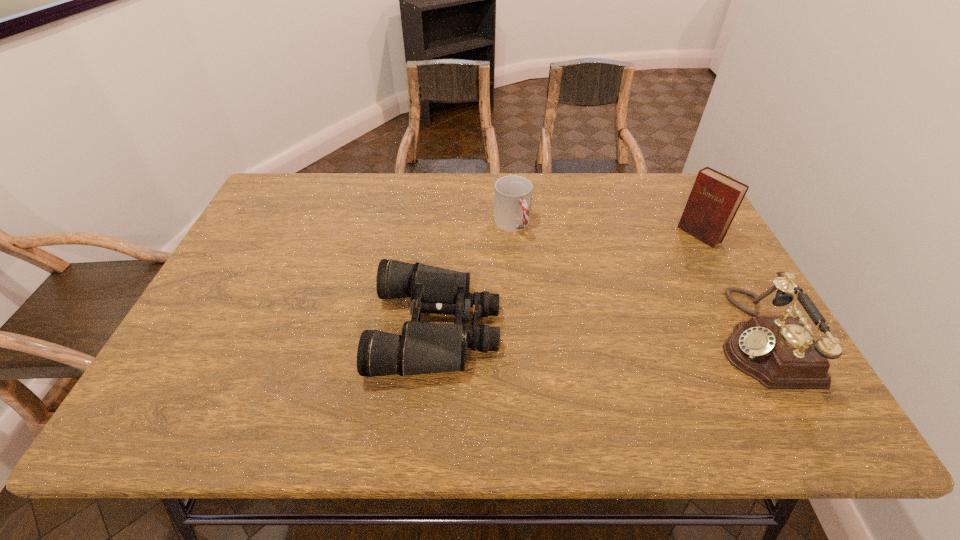
What are the coordinates of `free space that satisfies the following two spatial constraints: 1. on the front side of the telephone; 2. on the dial of the cup` in the screenshot? It's located at (521, 338).

Image resolution: width=960 pixels, height=540 pixels. Identify the location of free space that satisfies the following two spatial constraints: 1. on the front side of the diary; 2. on the dial of the telephone. (756, 338).